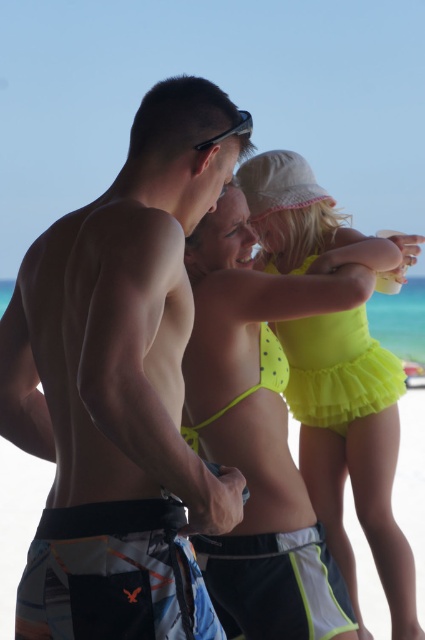
Between neon yellow swimsuit at center and matte black goggles at upper center, which one is positioned lower?

neon yellow swimsuit at center is below.

What do you see at coordinates (351, 448) in the screenshot? The image size is (425, 640). I see `neon yellow swimsuit at center` at bounding box center [351, 448].

Is point (385, 388) positioned after point (207, 141)?

That is True.

Identify the location of neon yellow swimsuit at center. (351, 448).

Can you confirm if matte swim trunks at center is shorter than neon green fabric shorts at lower center?

Incorrect, matte swim trunks at center's height does not fall short of neon green fabric shorts at lower center's.

Between point (164, 371) and point (339, 605), which one is positioned in front?

Positioned in front is point (164, 371).

Describe the element at coordinates (121, 388) in the screenshot. The width and height of the screenshot is (425, 640). I see `matte swim trunks at center` at that location.

What are the coordinates of `matte swim trunks at center` in the screenshot? It's located at (121, 388).

Which of these two, printed fabric boardshorts at lower left or yellow tulle skirt at lower center, stands shorter?

printed fabric boardshorts at lower left

Is printed fabric boardshorts at lower left positioned at the back of yellow tulle skirt at lower center?

No, it is not.

This screenshot has width=425, height=640. Describe the element at coordinates (113, 576) in the screenshot. I see `printed fabric boardshorts at lower left` at that location.

Identify the location of printed fabric boardshorts at lower left. This screenshot has height=640, width=425. (113, 576).